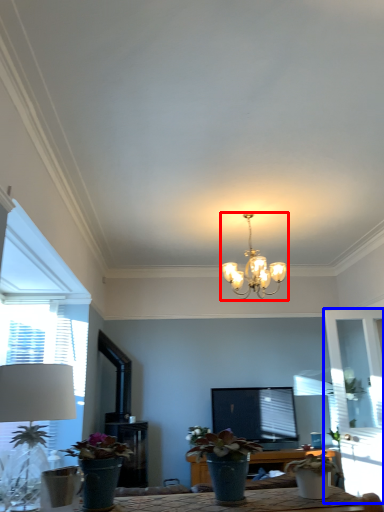
Question: Which of the following is the closest to the observer, lamp (highlighted by a red box) or glass door (highlighted by a blue box)?

Choices:
 (A) lamp
 (B) glass door

Answer: (A)